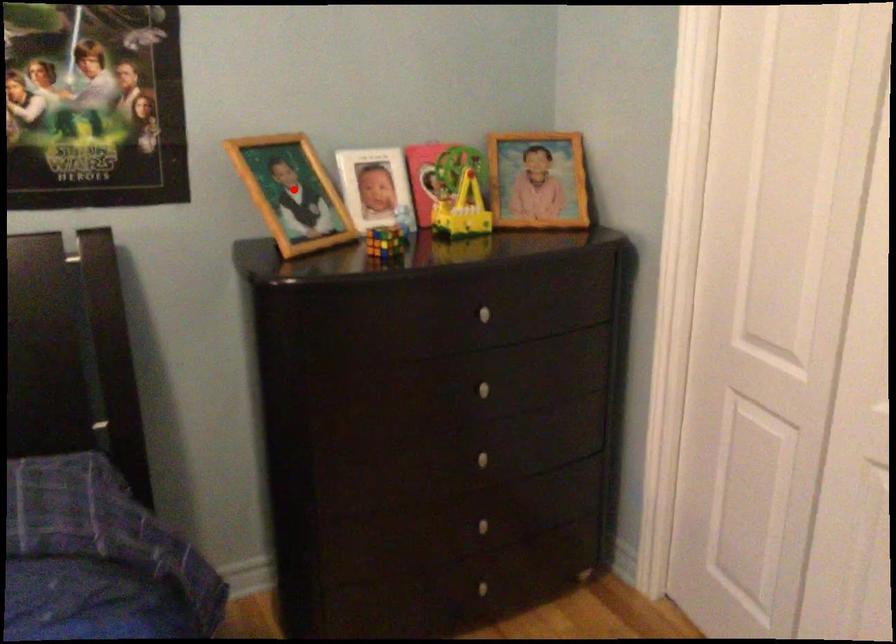
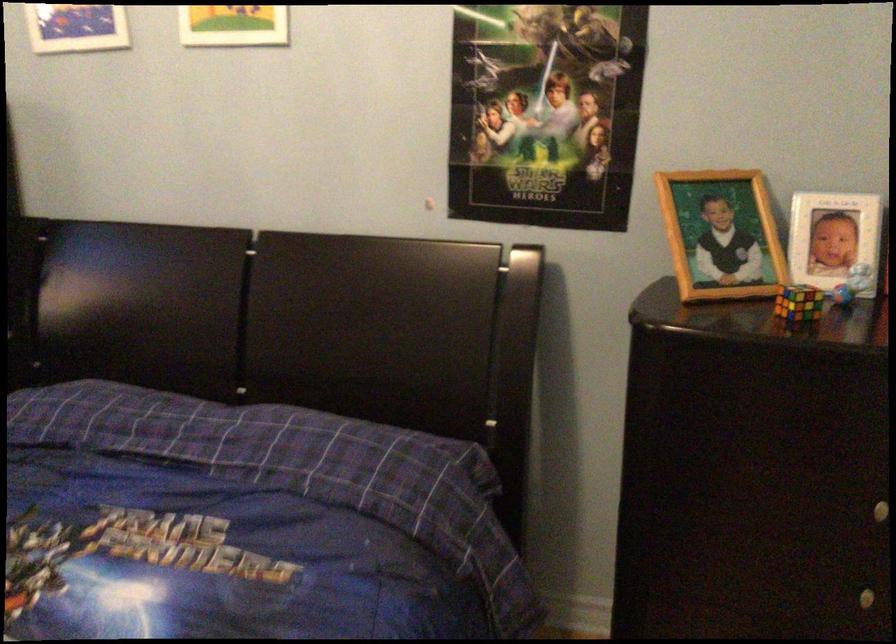
Find the pixel in the second image that matches the highlighted location in the first image.

(720, 234)